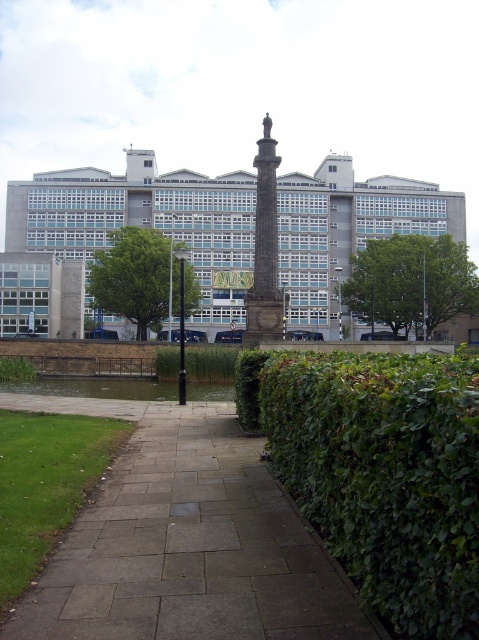
You are a gardener who needs to mow the grass between the gray stone pavement at center and the green leafy hedge at right. Which object is taller so you can adjust your mower height accordingly?

The green leafy hedge at right is taller than the gray stone pavement at center, so you should adjust your mower height to accommodate the hedge.

You are standing at point (464, 532) and want to walk to the monument in the center of the park. Is point (181, 508) between you and the monument?

Yes, point (181, 508) is between you and the monument because it is behind point (464, 532), which is your current position.

You are standing at the entrance of the park and want to reach the monument. According to the image, where is the gray stone pavement at center located?

The gray stone pavement at center is located at point (185, 541).